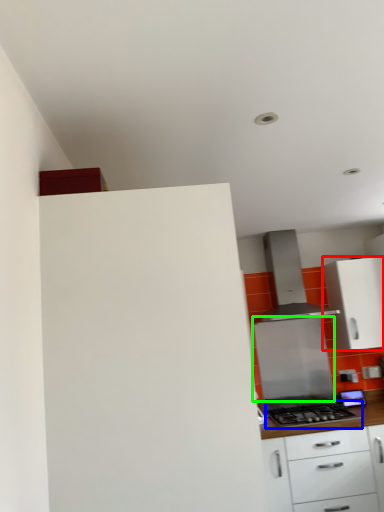
Question: Estimate the real-world distances between objects in this image. Which object is closer to cabinetry (highlighted by a red box), gas stove (highlighted by a blue box) or appliance (highlighted by a green box)?

Choices:
 (A) gas stove
 (B) appliance

Answer: (B)